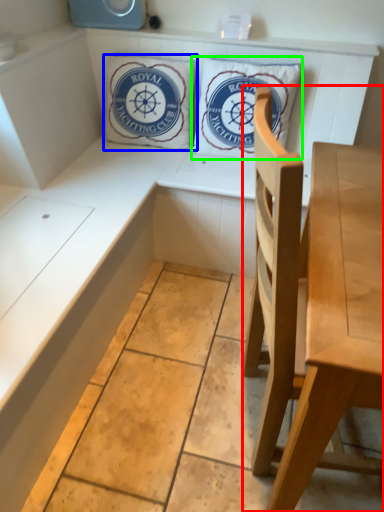
Question: Based on their relative distances, which object is farther from chair (highlighted by a red box)? Choose from pillow (highlighted by a blue box) and pillow (highlighted by a green box).

Choices:
 (A) pillow
 (B) pillow

Answer: (A)